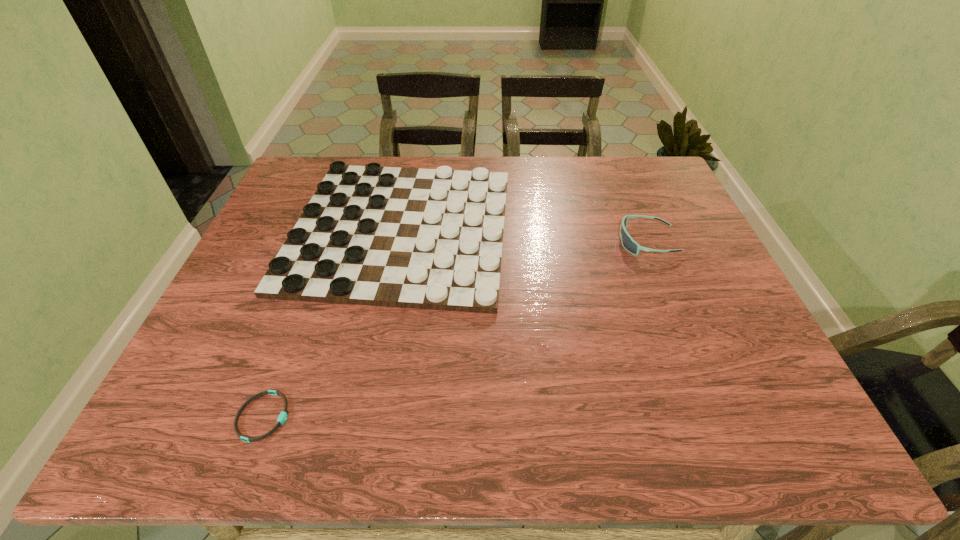
At what (x,y) coordinates should I click in order to perform the action: click on the tallest object. Please return your answer as a coordinate pair (x, y). The image size is (960, 540). Looking at the image, I should click on (629, 244).

At what (x,y) coordinates should I click in order to perform the action: click on the rightmost object. Please return your answer as a coordinate pair (x, y). The image size is (960, 540). Looking at the image, I should click on (629, 244).

Where is `gameboard`? gameboard is located at coordinates (432, 239).

Identify the location of the nearest object. This screenshot has height=540, width=960. (283, 416).

Identify the location of the shortest object. The width and height of the screenshot is (960, 540). (283, 416).

This screenshot has height=540, width=960. Find the location of `free space located on the front-facing side of the tallest object`. free space located on the front-facing side of the tallest object is located at coordinates (479, 242).

Locate an element on the screen. This screenshot has width=960, height=540. vacant space located 0.140m on the front-facing side of the tallest object is located at coordinates (565, 242).

Identify the location of free space located on the front-facing side of the tallest object. The height and width of the screenshot is (540, 960). (577, 242).

In order to click on free space located 0.300m on the right of the second tallest object in this screenshot , I will do `click(621, 230)`.

Find the location of `vacant area located 0.130m on the buckle of the shortest object`. vacant area located 0.130m on the buckle of the shortest object is located at coordinates (359, 417).